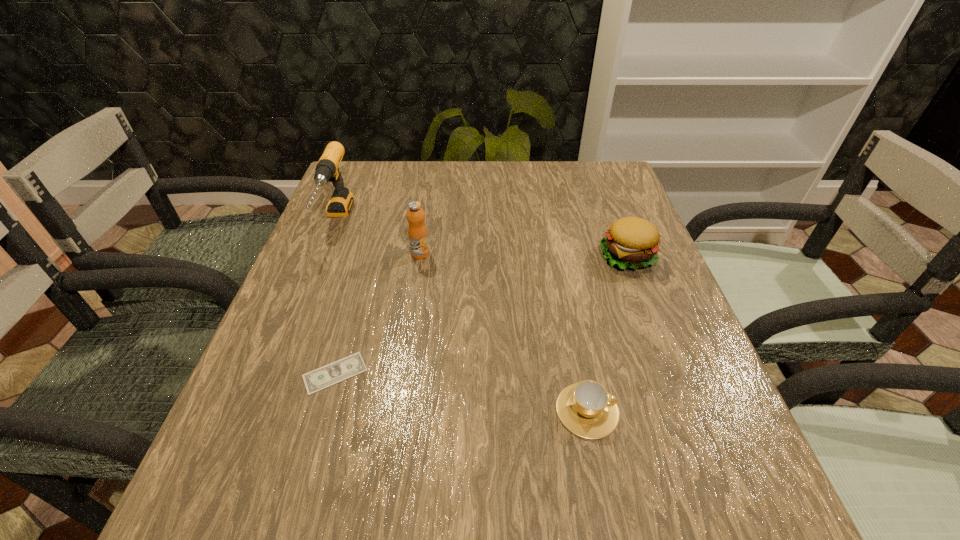
Image resolution: width=960 pixels, height=540 pixels. In the image, there is a desktop. In order to click on free space at the left edge in this screenshot , I will do `click(348, 339)`.

Where is `vacant space at the right edge of the desktop`? The height and width of the screenshot is (540, 960). vacant space at the right edge of the desktop is located at coordinates (617, 274).

Where is `vacant region at the far left corner of the desktop`? The width and height of the screenshot is (960, 540). vacant region at the far left corner of the desktop is located at coordinates (352, 163).

Where is `free space at the far right corner of the desktop`? free space at the far right corner of the desktop is located at coordinates (565, 170).

The image size is (960, 540). What are the coordinates of `free area in between the drill and the second object from left to right` in the screenshot? It's located at (335, 297).

Where is `free space between the fourth object from right to left and the second tallest object`? free space between the fourth object from right to left and the second tallest object is located at coordinates (377, 313).

Identify the location of vacant region between the orange juice and the cup. The height and width of the screenshot is (540, 960). (504, 332).

Where is `empty space that is in between the second shortest object and the shortest object`? empty space that is in between the second shortest object and the shortest object is located at coordinates (461, 392).

This screenshot has width=960, height=540. Find the location of `vacant space that is in between the rightmost object and the drill`. vacant space that is in between the rightmost object and the drill is located at coordinates (482, 239).

The image size is (960, 540). In order to click on unoccupied area between the second object from right to left and the drill in this screenshot , I will do pos(462,316).